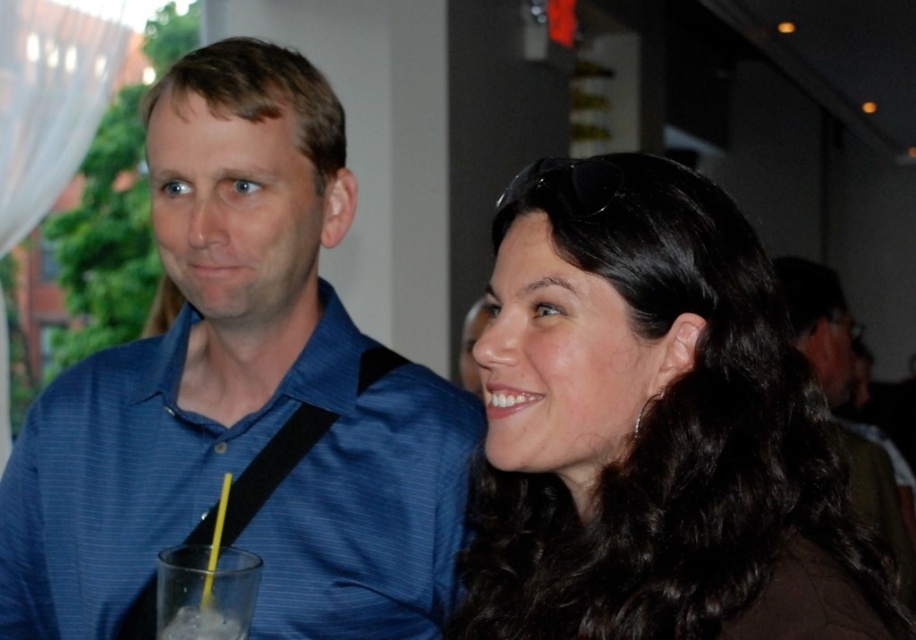
You are standing in front of the image and want to determine which of the two points, point (551,200) or point (230,609), is nearer to you. Based on the description, which point is closer?

Point (551,200) is closer to the camera than point (230,609), so it is the nearer one.

You are standing in the same room as the two people in the image. The black shiny hair at upper right is represented by point (653, 428). Where is the black shiny hair at upper right located relative to the other person?

The black shiny hair at upper right is located at point (653, 428), which is to the right of the man wearing a blue collared shirt with vertical stripes.